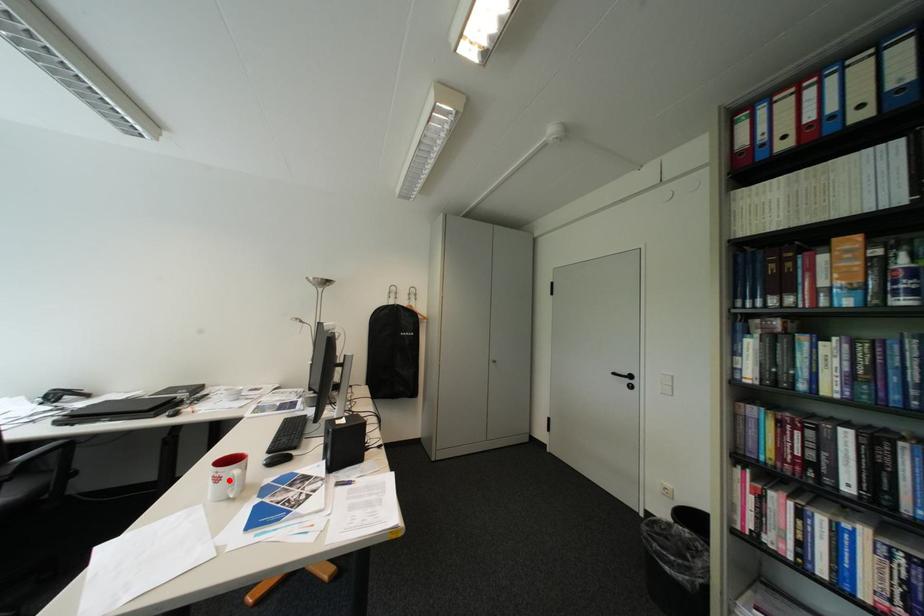
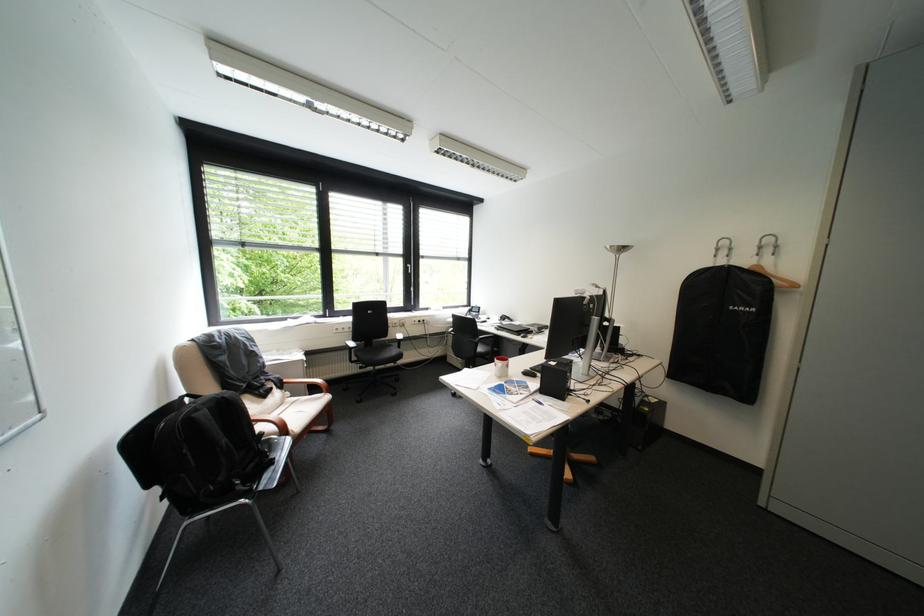
Find the pixel in the second image that matches the highlighted location in the first image.

(507, 365)